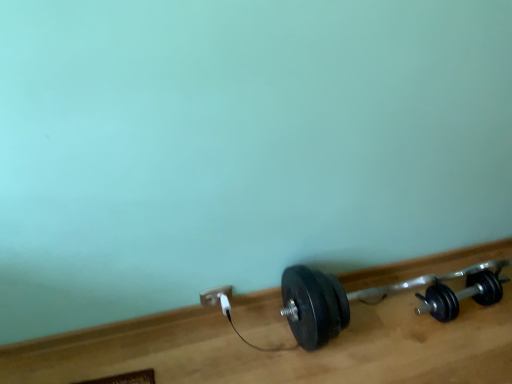
The height and width of the screenshot is (384, 512). Find the location of `free space to the right of white plastic plug at lower center`. free space to the right of white plastic plug at lower center is located at coordinates (265, 330).